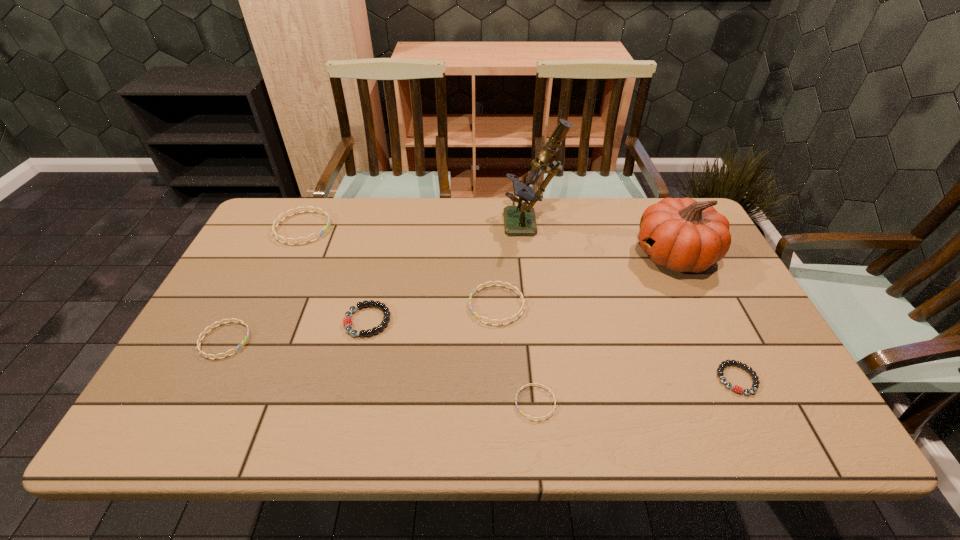
You are a GUI agent. You are given a task and a screenshot of the screen. Output one action in this format:
    pyautogui.click(x=<x>, y=<y>)
    Task: Click on the free space between the microscope and the left black bracelet
    
    Given the screenshot: What is the action you would take?
    pyautogui.click(x=449, y=273)

Identify the location of the third closest object to the microscope. (347, 321).

Identify which object is the fourth nearest to the microscope. Please provide its 2D coordinates. Your answer should be formatted as a tuple, i.e. [(x, y)], where the tuple contains the x and y coordinates of a point satisfying the conditions above.

[(539, 419)]

This screenshot has width=960, height=540. I want to click on the closest bracelet to the second smallest blue bracelet, so click(x=347, y=321).

Identify the location of bracelet that is the fifth closest to the biggest blue bracelet. (720, 369).

Identify which blue bracelet is the second nearest to the farthest blue bracelet. Please provide its 2D coordinates. Your answer should be formatted as a tuple, i.e. [(x, y)], where the tuple contains the x and y coordinates of a point satisfying the conditions above.

[(519, 293)]

This screenshot has height=540, width=960. I want to click on blue bracelet object that ranks as the closest to the second biggest blue bracelet, so click(x=539, y=419).

You are a GUI agent. You are given a task and a screenshot of the screen. Output one action in this format:
    pyautogui.click(x=<x>, y=<y>)
    Task: Click on the vacant area in the image that satisfies the following two spatial constraints: 1. on the surface of the smaller black bracelet showing star-shaped elements; 2. on the left side of the sixth shortest object
    The image size is (960, 540).
    Given the screenshot: What is the action you would take?
    tap(231, 379)

Locate an element on the screen. free space that satisfies the following two spatial constraints: 1. on the back side of the nearer black bracelet; 2. on the surface of the third smallest blue bracelet showing star-shaped elements is located at coordinates (701, 305).

Find the location of `vacant space that satisfies the following two spatial constraints: 1. on the back side of the smaller black bracelet; 2. on the surface of the third biggest blue bracelet showing star-shaped elements`. vacant space that satisfies the following two spatial constraints: 1. on the back side of the smaller black bracelet; 2. on the surface of the third biggest blue bracelet showing star-shaped elements is located at coordinates (718, 340).